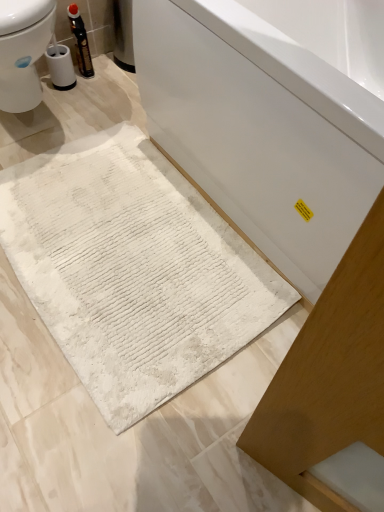
Identify the location of white textured bath mat at lower center. This screenshot has height=512, width=384. (132, 270).

Image resolution: width=384 pixels, height=512 pixels. I want to click on white glossy bathtub at center, so click(271, 116).

This screenshot has height=512, width=384. In order to click on matte black bottle at upper left in this screenshot , I will do `click(80, 41)`.

Locate an element on the screen. This screenshot has width=384, height=512. white textured bath mat at lower center is located at coordinates (132, 270).

This screenshot has height=512, width=384. Identify the location of bathtub in front of the white textured bath mat at lower center. (271, 116).

Can you tell me how much white glossy bathtub at center and white textured bath mat at lower center differ in facing direction?

The angle between the facing direction of white glossy bathtub at center and the facing direction of white textured bath mat at lower center is 0.23 degrees.

Which is in front, white glossy bathtub at center or white textured bath mat at lower center?

white glossy bathtub at center.

Considering the sizes of objects white glossy bathtub at center and white textured bath mat at lower center in the image provided, who is bigger, white glossy bathtub at center or white textured bath mat at lower center?

white glossy bathtub at center is bigger.

Who is taller, white textured bath mat at lower center or matte black bottle at upper left?

matte black bottle at upper left is taller.

Is white textured bath mat at lower center positioned beyond the bounds of matte black bottle at upper left?

Indeed, white textured bath mat at lower center is completely outside matte black bottle at upper left.

Is white textured bath mat at lower center with matte black bottle at upper left?

white textured bath mat at lower center and matte black bottle at upper left are clearly separated.

From a real-world perspective, relative to white glossy bathtub at center, is white textured bath mat at lower center vertically above or below?

From a real-world perspective, white textured bath mat at lower center is physically below white glossy bathtub at center.

Does point (61, 334) come behind point (206, 110)?

Yes, point (61, 334) is farther from viewer.

Looking at this image, does white textured bath mat at lower center come in front of white glossy bathtub at center?

No, it is not.

Does white textured bath mat at lower center appear on the left side of white glossy bathtub at center?

Yes.

Is point (145, 89) positioned behind point (80, 54)?

No, (145, 89) is in front of (80, 54).

Where is `bottle that is on the left side of white glossy bathtub at center`? This screenshot has width=384, height=512. bottle that is on the left side of white glossy bathtub at center is located at coordinates (80, 41).

From the image's perspective, which object appears higher, white glossy bathtub at center or matte black bottle at upper left?

matte black bottle at upper left.

Considering the sizes of objects white glossy bathtub at center and matte black bottle at upper left in the image provided, who is shorter, white glossy bathtub at center or matte black bottle at upper left?

matte black bottle at upper left is shorter.

From the image's perspective, does matte black bottle at upper left appear lower than white glossy bathtub at center?

Actually, matte black bottle at upper left appears above white glossy bathtub at center in the image.

Looking at this image, looking at their sizes, would you say matte black bottle at upper left is wider or thinner than white glossy bathtub at center?

matte black bottle at upper left is thinner than white glossy bathtub at center.

How different are the orientations of matte black bottle at upper left and white glossy bathtub at center in degrees?

82.3 degrees.

In the scene shown: Is matte black bottle at upper left located outside white glossy bathtub at center?

Yes.

Which is more to the left, matte black bottle at upper left or white textured bath mat at lower center?

From the viewer's perspective, matte black bottle at upper left appears more on the left side.

Does matte black bottle at upper left turn towards white textured bath mat at lower center?

No, matte black bottle at upper left is not oriented towards white textured bath mat at lower center.

From the image's perspective, relative to white textured bath mat at lower center, is matte black bottle at upper left above or below?

From the image's perspective, matte black bottle at upper left appears above white textured bath mat at lower center.

Is matte black bottle at upper left closer to the viewer compared to white textured bath mat at lower center?

No.

Image resolution: width=384 pixels, height=512 pixels. In the image, there is a white glossy bathtub at center. Find the location of `bath mat below it (from the image's perspective)`. bath mat below it (from the image's perspective) is located at coordinates (132, 270).

Identify the location of bath mat that appears below the matte black bottle at upper left (from a real-world perspective). This screenshot has width=384, height=512. (132, 270).

Considering their positions, is white glossy bathtub at center positioned closer to matte black bottle at upper left than white textured bath mat at lower center?

Among the two, white textured bath mat at lower center is located nearer to matte black bottle at upper left.

When comparing their distances from white textured bath mat at lower center, does matte black bottle at upper left or white glossy bathtub at center seem closer?

white glossy bathtub at center is closer to white textured bath mat at lower center.

Looking at this image, estimate the real-world distances between objects in this image. Which object is closer to matte black bottle at upper left, white textured bath mat at lower center or white glossy bathtub at center?

white textured bath mat at lower center lies closer to matte black bottle at upper left than the other object.

Which object lies further to the anchor point white glossy bathtub at center, matte black bottle at upper left or white textured bath mat at lower center?

The object further to white glossy bathtub at center is matte black bottle at upper left.

Considering their positions, is white glossy bathtub at center positioned further to white textured bath mat at lower center than matte black bottle at upper left?

matte black bottle at upper left is further to white textured bath mat at lower center.

Looking at the image, which one is located closer to white glossy bathtub at center, white textured bath mat at lower center or matte black bottle at upper left?

Among the two, white textured bath mat at lower center is located nearer to white glossy bathtub at center.

Image resolution: width=384 pixels, height=512 pixels. Find the location of `bath mat between white glossy bathtub at center and matte black bottle at upper left in the front-back direction`. bath mat between white glossy bathtub at center and matte black bottle at upper left in the front-back direction is located at coordinates (132, 270).